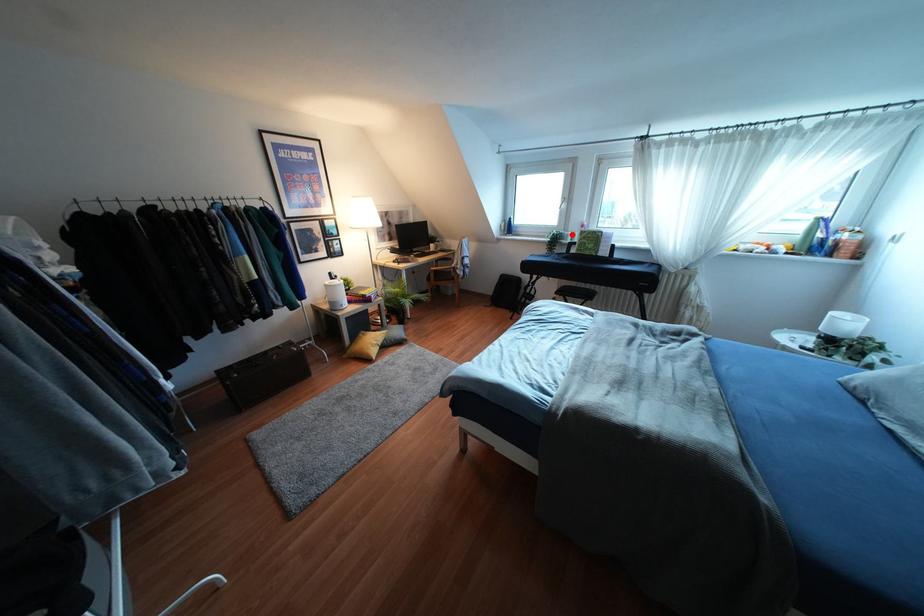
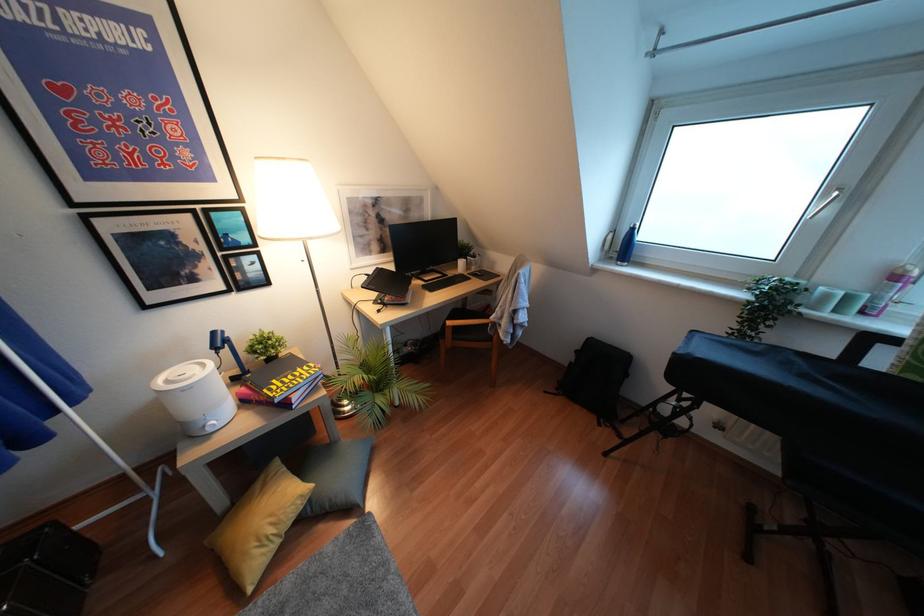
In the second image, find the point that corresponds to the highlighted location in the first image.

(846, 298)